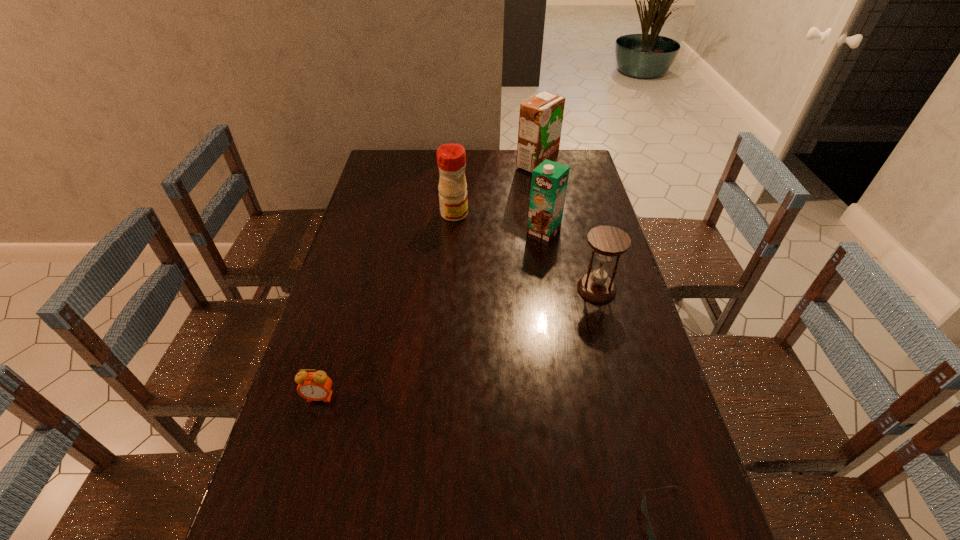
Locate an element on the screen. free region at the left edge of the desktop is located at coordinates (386, 257).

Image resolution: width=960 pixels, height=540 pixels. Find the location of `vacant area at the right edge`. vacant area at the right edge is located at coordinates (581, 241).

Where is `vacant space at the far left corner`? The height and width of the screenshot is (540, 960). vacant space at the far left corner is located at coordinates (407, 174).

In order to click on free space at the far right corner of the desktop in this screenshot , I will do `click(582, 177)`.

The height and width of the screenshot is (540, 960). Find the location of `free space that is in between the alarm clock and the farthest object`. free space that is in between the alarm clock and the farthest object is located at coordinates (428, 281).

The image size is (960, 540). I want to click on empty space between the fifth object from right to left and the nearer carton, so click(499, 222).

This screenshot has height=540, width=960. I want to click on vacant space that is in between the fifth farthest object and the third nearest object, so click(x=458, y=343).

Find the location of a particular element. The width and height of the screenshot is (960, 540). empty location between the alarm clock and the fourth tallest object is located at coordinates (458, 343).

Find the location of a particular element. the fourth closest object to the sunglasses is located at coordinates (451, 158).

Locate an element on the screen. The image size is (960, 540). object that ranks as the fourth closest to the farther carton is located at coordinates (314, 386).